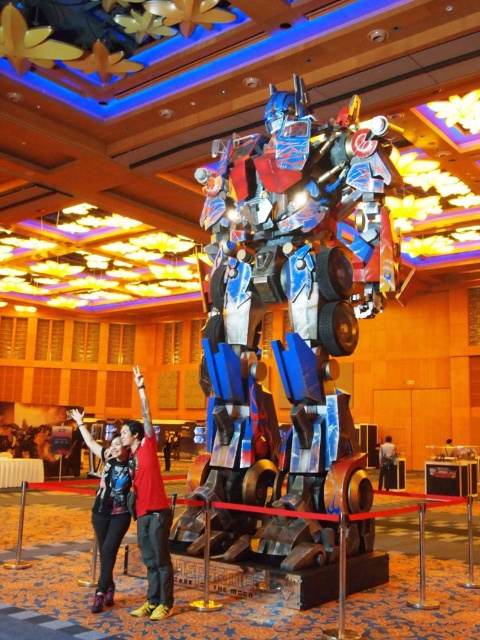
You are standing in front of the robotic figure and want to take a photo. There are two points marked on the floor where you can stand to get the best angle. The first point is at coordinates point (131,422) and the second is at point (107,461). Which point is closer to you so that you can take the photo without moving too far?

Point (131,422) is closer to the viewer than point (107,461), so you should stand at point (131,422) to take the photo without moving too far.

You are a photographer trying to capture a photo of the metallic blue transformer at center and the red shirt at center. Since you want both subjects to be clearly visible, which one should you focus on first to ensure proper framing?

The metallic blue transformer at center is positioned on the right side of red shirt at center, so you should focus on the red shirt at center first to ensure both are framed properly.

You are standing in the grand hall and want to take a photo of the metallic blue transformer at center without any people in the frame. Where should you position yourself relative to the point marked at coordinates point (290, 296)?

You should position yourself behind the point marked at coordinates point (290, 296) to ensure the metallic blue transformer at center is visible without any people obstructing the view.